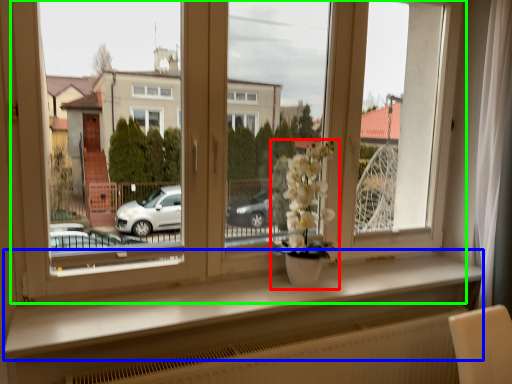
Question: Which is nearer to the houseplant (highlighted by a red box)? window sill (highlighted by a blue box) or window (highlighted by a green box).

Choices:
 (A) window sill
 (B) window

Answer: (B)